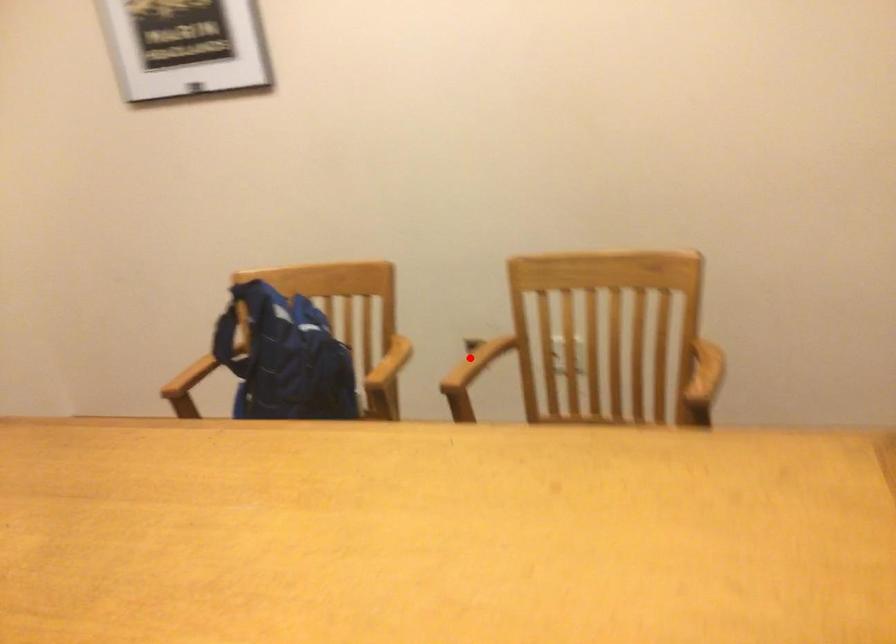
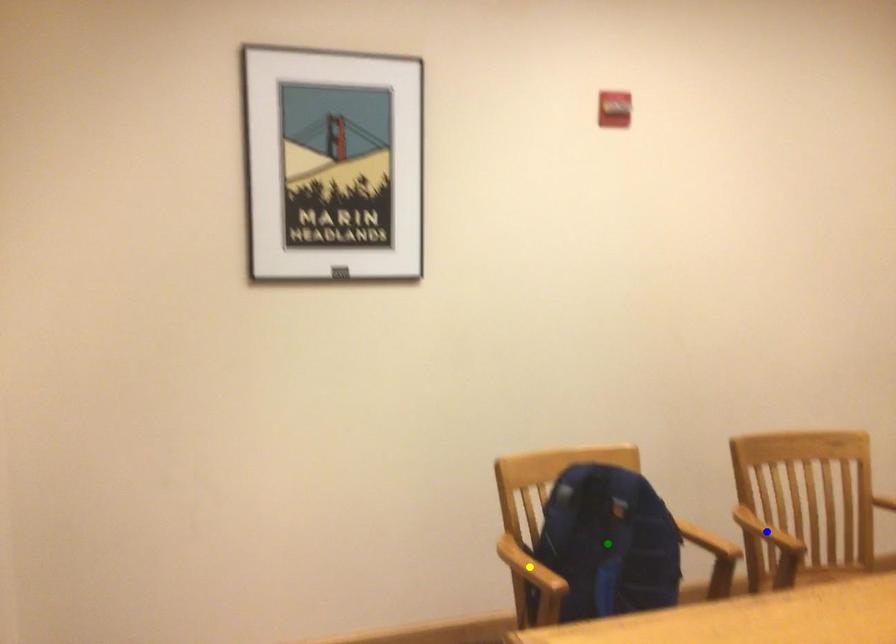
Question: I am providing you with two images of the same scene from different viewpoints. A red point is marked on the first image. You are given multiple points on the second image. Which point in image 2 represents the same 3d spot as the red point in image 1?

Choices:
 (A) blue point
 (B) green point
 (C) yellow point

Answer: (A)